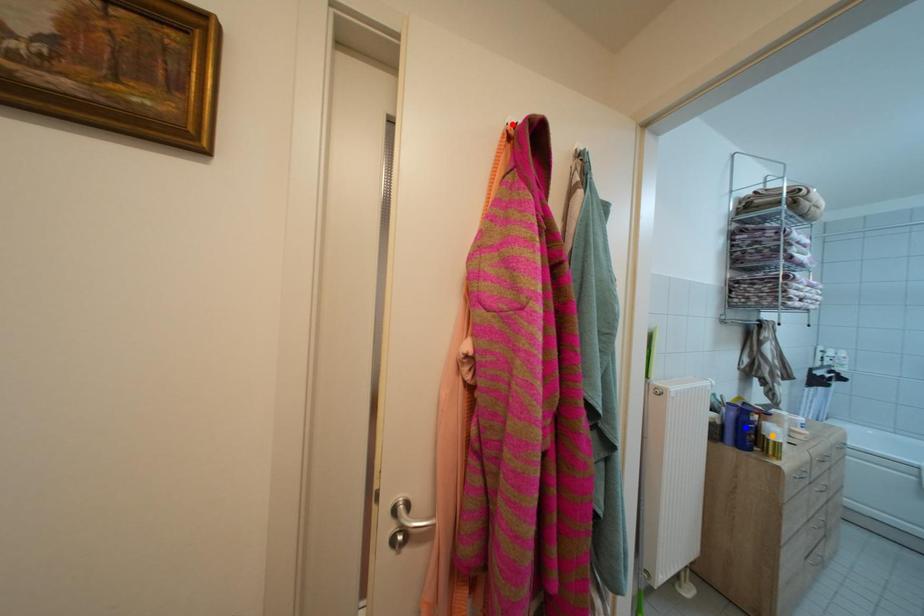
Order these from nearest to farthest:
red point, orange point, blue point

orange point < blue point < red point